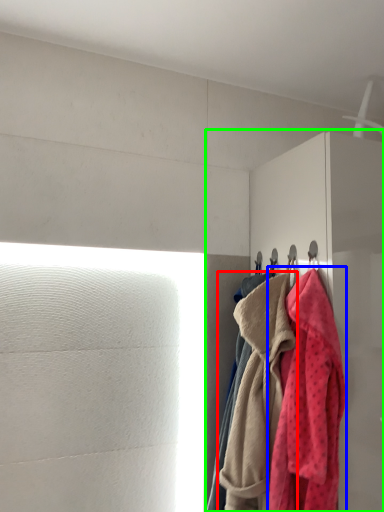
Question: Considering the real-world distances, which object is closest to towel (highlighted by a red box)? towel (highlighted by a blue box) or dresser (highlighted by a green box).

Choices:
 (A) towel
 (B) dresser

Answer: (A)